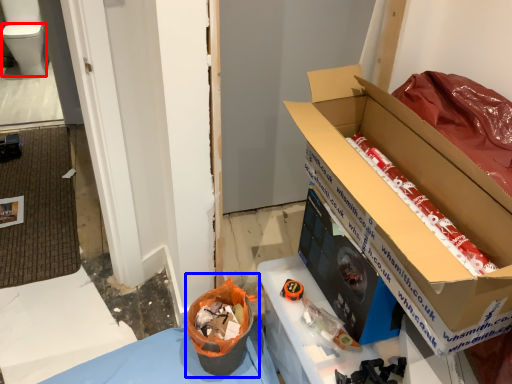
Question: Which object is further to the camera taking this photo, toilet bowl (highlighted by a red box) or recycling bin (highlighted by a blue box)?

Choices:
 (A) toilet bowl
 (B) recycling bin

Answer: (A)